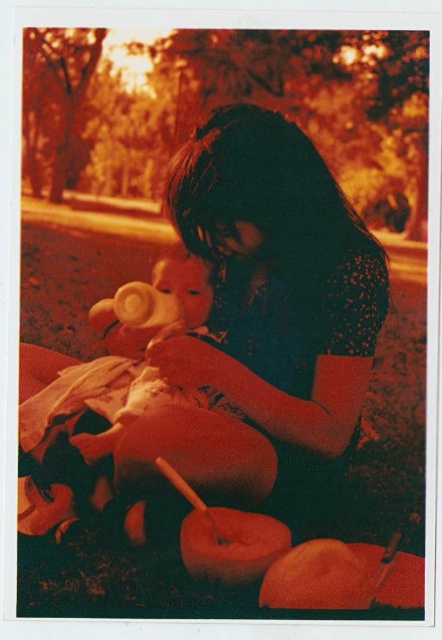
Question: From the image, what is the correct spatial relationship of matte black dress at center in relation to smooth beige bottle at left?

Choices:
 (A) left
 (B) right

Answer: (B)

Question: Which point is farther to the camera?

Choices:
 (A) smooth beige bottle at left
 (B) matte black dress at center

Answer: (B)

Question: Is matte black dress at center above smooth beige bottle at left?

Choices:
 (A) yes
 (B) no

Answer: (A)

Question: Does matte black dress at center have a smaller size compared to smooth beige bottle at left?

Choices:
 (A) no
 (B) yes

Answer: (A)